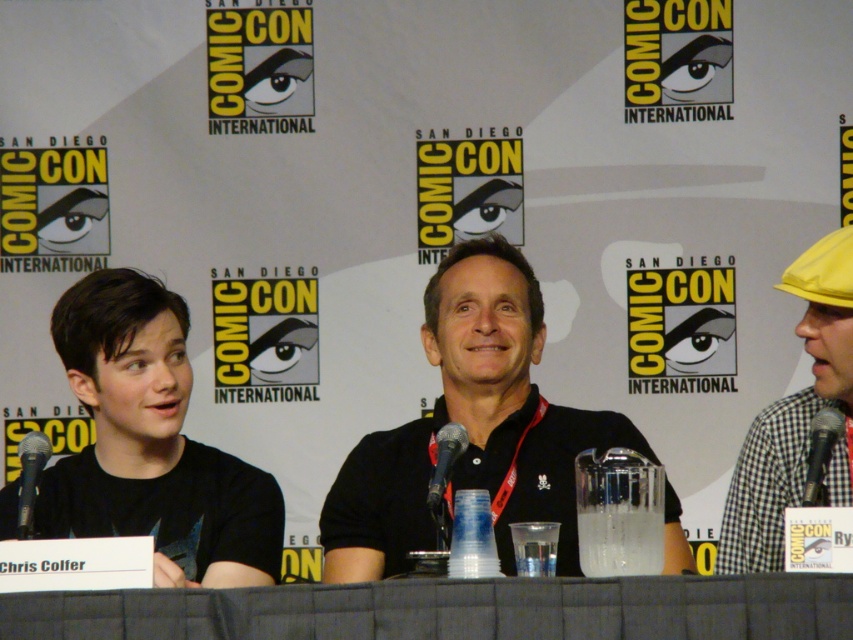
You are a photographer at the event and want to capture a clear shot of the gray fabric table at center and the black metallic microphone at center. Which object will appear larger in your photo?

The gray fabric table at center will appear larger in the photo because it is closer to the viewer than the black metallic microphone at center.

You are attending a panel discussion at San Diego Comic Con and see two black metallic microphones on the table. Which one is positioned further to the right between the black metallic microphone at right and the black metallic microphone at center?

The black metallic microphone at right is positioned further to the right compared to the black metallic microphone at center.

Based on the scene description, where is the black matte shirt at left located in terms of its 2D coordinates?

The black matte shirt at left is located at the 2D coordinates of point (151, 444).